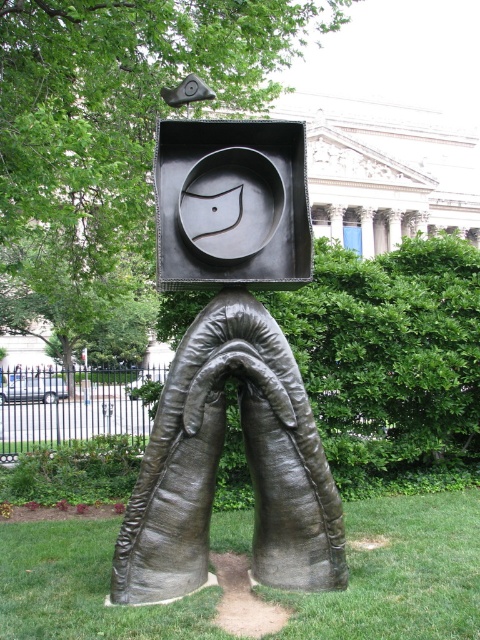
You are standing in a park and see the bronze sculpture at center and the green grass at lower center. Which object is positioned to the left when viewed from your perspective?

The bronze sculpture at center is to the left of the green grass at lower center, so the bronze sculpture at center is positioned to the left.

You are a landscape architect designing a new public garden. You want to place a small decorative fountain that is the same size as the green grass at lower center next to the bronze sculpture at center. Will the fountain be smaller than the sculpture?

The bronze sculpture at center has a larger size compared to green grass at lower center, so the fountain, being the same size as the green grass at lower center, will indeed be smaller than the sculpture.